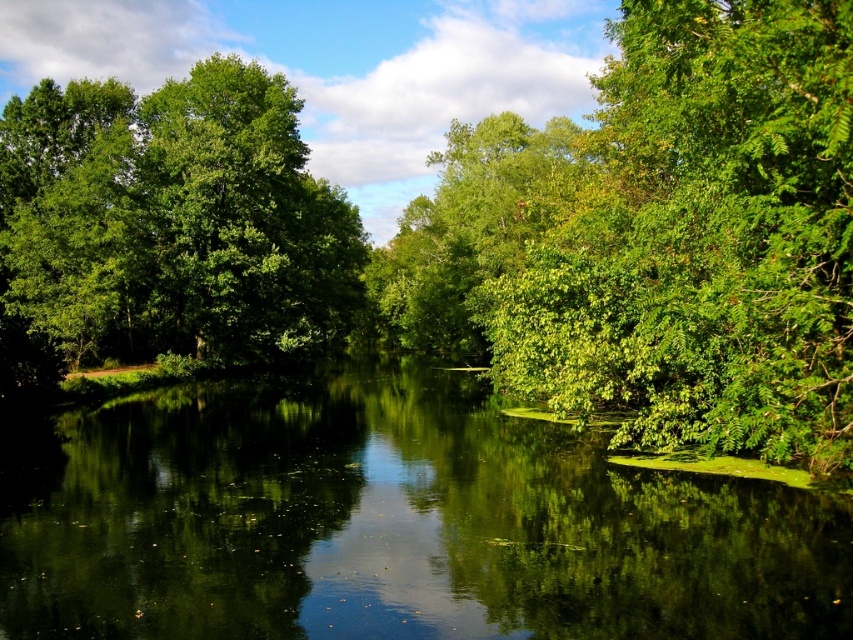
Can you confirm if green leafy tree at upper right is positioned to the left of green leafy tree at center?

No, green leafy tree at upper right is not to the left of green leafy tree at center.

Can you confirm if green leafy tree at upper right is shorter than green leafy tree at center?

Yes, green leafy tree at upper right is shorter than green leafy tree at center.

The image size is (853, 640). Identify the location of green leafy tree at upper right. (701, 240).

This screenshot has width=853, height=640. I want to click on green leafy tree at upper right, so click(701, 240).

Which of these two, green leafy forest at center or green reflective water at center, stands taller?

Standing taller between the two is green leafy forest at center.

Does green leafy forest at center have a smaller size compared to green reflective water at center?

Incorrect, green leafy forest at center is not smaller in size than green reflective water at center.

Where is `green leafy forest at center`? The image size is (853, 640). green leafy forest at center is located at coordinates (479, 234).

Is green leafy forest at center wider than green leafy tree at center?

Indeed, green leafy forest at center has a greater width compared to green leafy tree at center.

Looking at this image, is green leafy forest at center behind green leafy tree at center?

No, it is not.

Who is more distant from viewer, [90,323] or [426,305]?

The point [426,305] is behind.

In order to click on green leafy forest at center in this screenshot , I will do `click(479, 234)`.